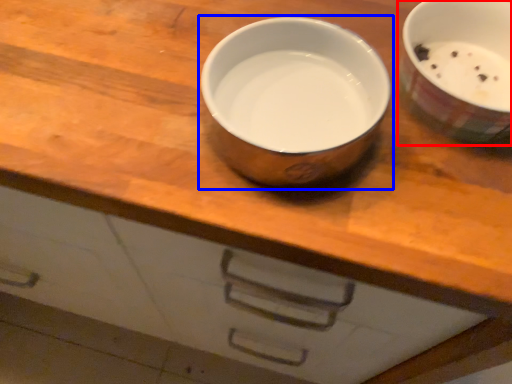
Question: Which point is closer to the camera, tableware (highlighted by a red box) or tableware (highlighted by a blue box)?

Choices:
 (A) tableware
 (B) tableware

Answer: (B)